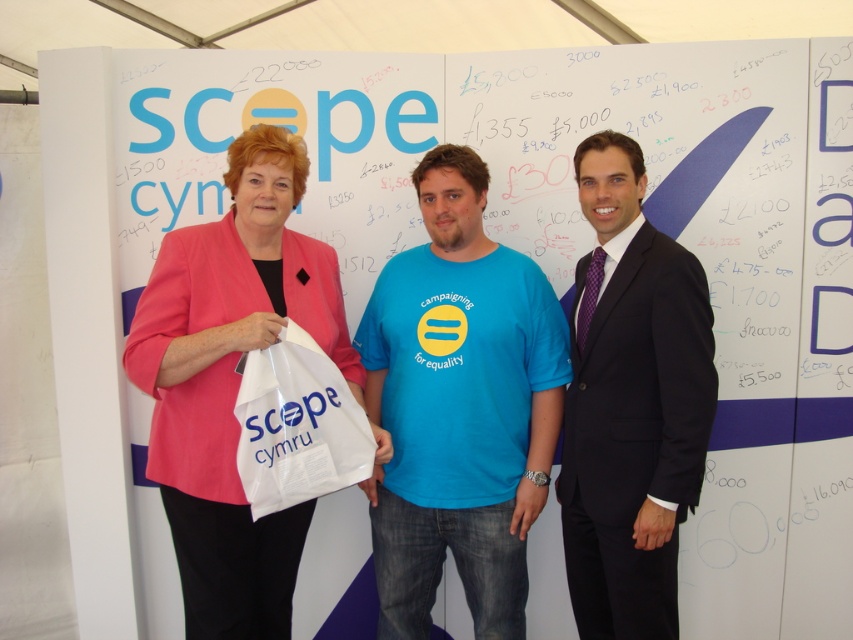
From the picture: Based on the scene, which of the two points, point (x=549, y=385) or point (x=280, y=467), is closer to the viewer?

Point (x=549, y=385) is further to the camera than point (x=280, y=467), so point (x=280, y=467) is closer to the viewer.

Consider the image. You are standing in front of the whiteboard and want to hand a document to the person wearing the pink fabric jacket at center. Where should you look to find them?

The pink fabric jacket at center is located at the coordinates point [231,381], so you should look towards that position to find the person wearing the pink fabric jacket at center.

You are a photographer setting up for a group photo. You want to ensure that the pink fabric jacket at center and the black suit at center are both visible in the frame. Based on their positions, which one is closer to the camera?

The pink fabric jacket at center is in front of the black suit at center, so it is closer to the camera.